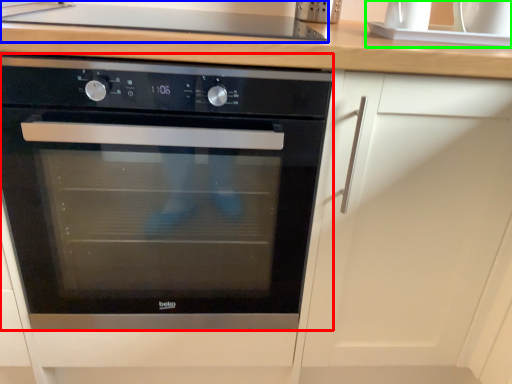
Question: Considering the real-world distances, which object is closest to oven (highlighted by a red box)? gas stove (highlighted by a blue box) or sink (highlighted by a green box).

Choices:
 (A) gas stove
 (B) sink

Answer: (A)